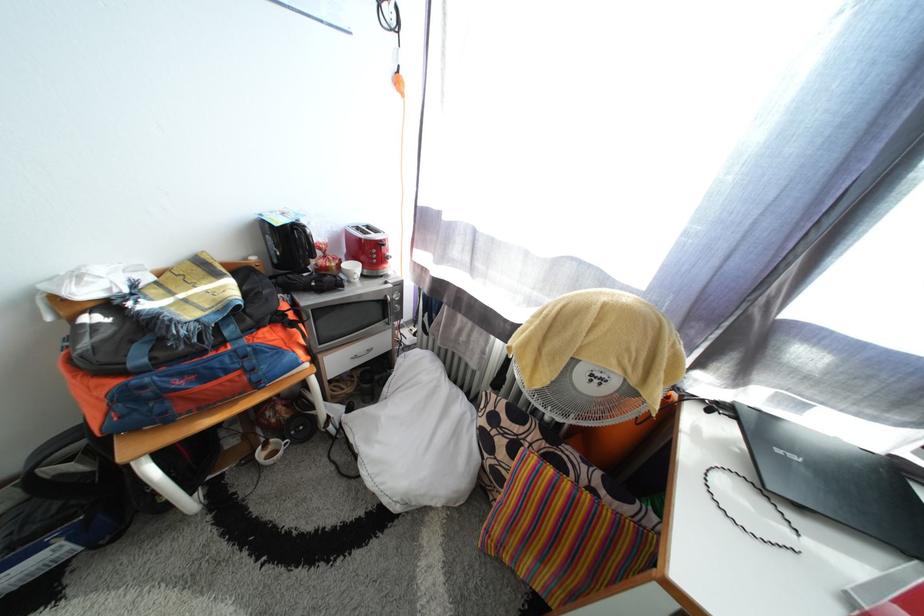
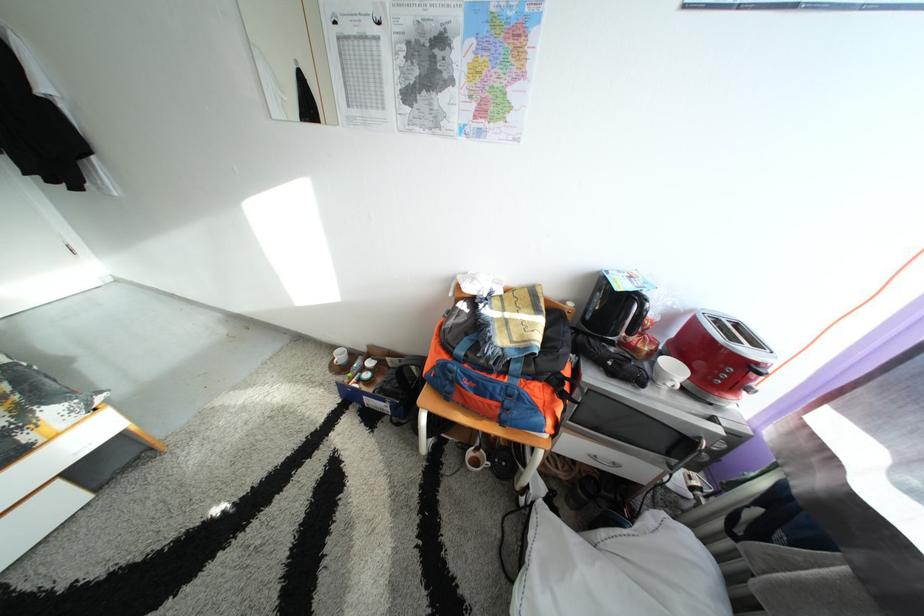
Question: I am providing you with two images of the same scene from different viewpoints. Which of the following objects are not visible in image2?

Choices:
 (A) white ceramic cup
 (B) toaster lever
 (C) microwave door handle
 (D) none of these

Answer: (D)